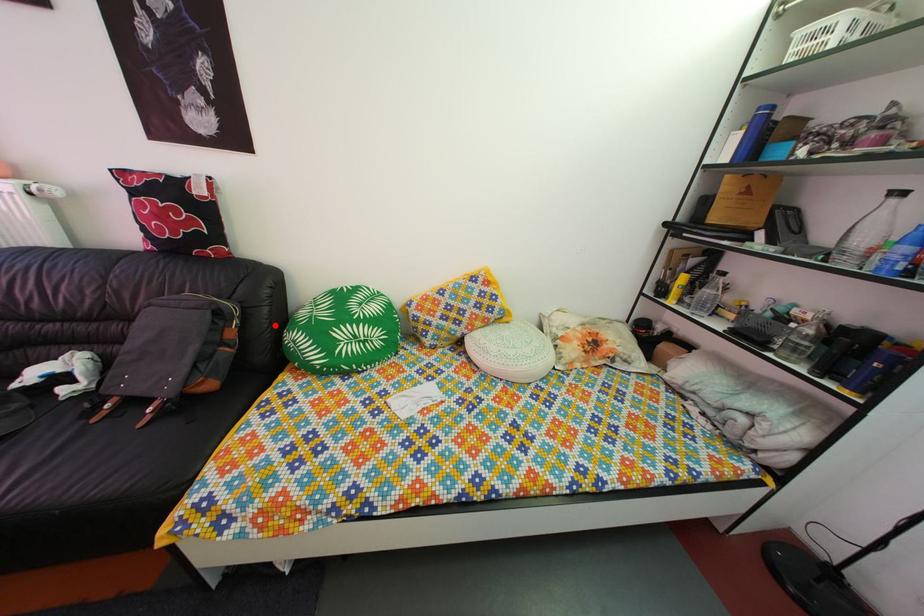
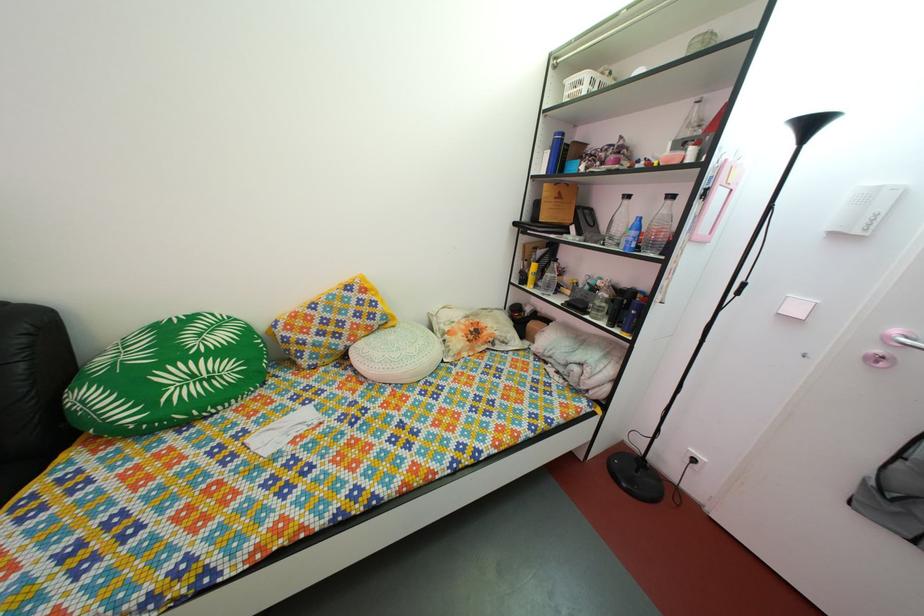
In the second image, find the point that corresponds to the highlighted location in the first image.

(31, 386)